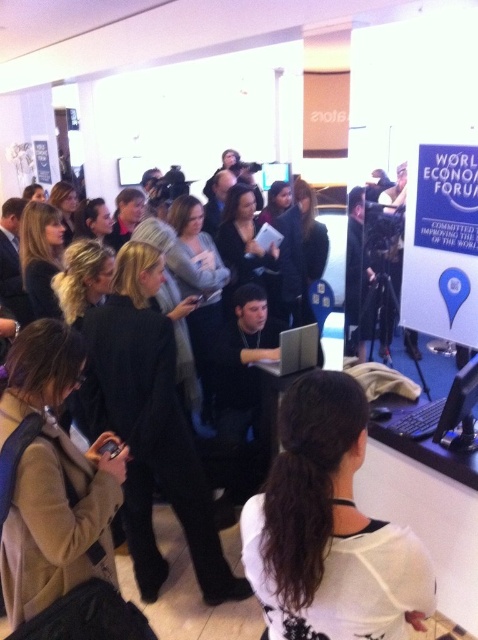
You are a photographer trying to capture a clear shot of the silver metallic laptop at center in the crowded press room. However, the white matte shirt at center is blocking your view. Can you adjust your position to see the laptop without moving the shirt? Explain why or why not based on their positions.

The white matte shirt at center is closer to the viewer than the silver metallic laptop at center. By moving your camera position slightly to the side or angle, you might be able to see around the white matte shirt at center to capture the silver metallic laptop at center without moving the shirt.

You are a photographer trying to capture a clear shot of the silver metallic laptop at center in the crowded press room. However, the white matte shirt at center is blocking your view. Based on their positions, can you adjust your angle to see the laptop without moving the shirt?

The white matte shirt at center is positioned under the silver metallic laptop at center, so adjusting your angle slightly upward should allow you to see the laptop without moving the shirt.

You are a photographer at the event and want to capture a clear shot of both the white matte shirt at center and the silver metallic laptop at center. Given their sizes, which object will appear bigger in your photo?

The white matte shirt at center will appear bigger in the photo because it is larger in size than the silver metallic laptop at center.